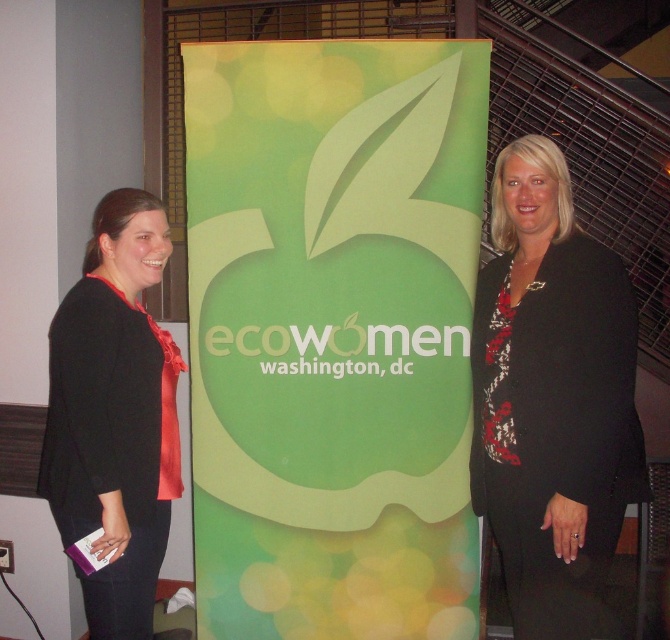
Question: Does black textured blazer at right appear on the right side of black satin blouse at left?

Choices:
 (A) yes
 (B) no

Answer: (A)

Question: Does black textured blazer at right have a smaller size compared to black satin blouse at left?

Choices:
 (A) yes
 (B) no

Answer: (B)

Question: Does black textured blazer at right have a lesser width compared to black satin blouse at left?

Choices:
 (A) no
 (B) yes

Answer: (A)

Question: Which object is closer to the camera taking this photo?

Choices:
 (A) black satin blouse at left
 (B) black textured blazer at right

Answer: (B)